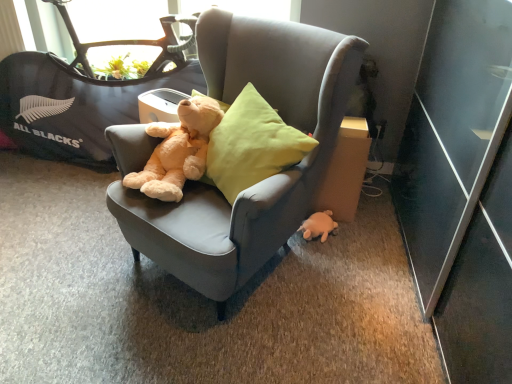
The height and width of the screenshot is (384, 512). Identify the location of vacant space to the right of velvet gray chair at center. (369, 282).